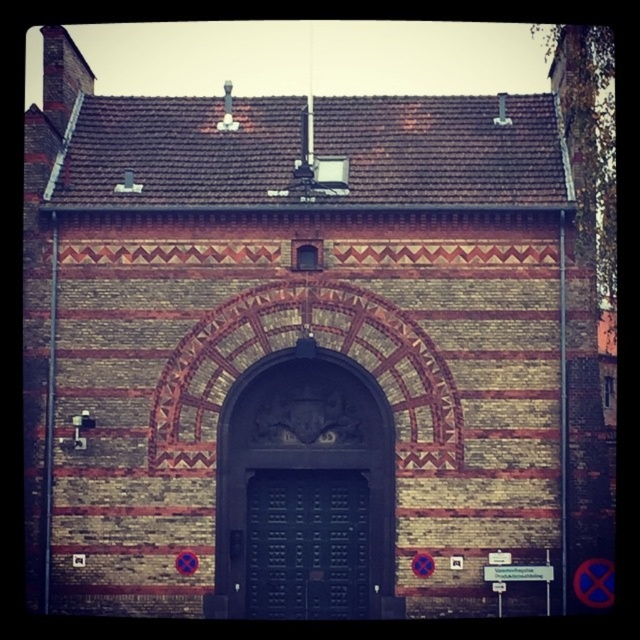
In the scene shown: Between dark green wooden door at center and dark wood door at center, which one is positioned higher?

Positioned higher is dark green wooden door at center.

Does dark green wooden door at center have a lesser height compared to dark wood door at center?

In fact, dark green wooden door at center may be taller than dark wood door at center.

Describe the element at coordinates (305, 490) in the screenshot. I see `dark green wooden door at center` at that location.

Where is `dark green wooden door at center`? This screenshot has width=640, height=640. dark green wooden door at center is located at coordinates (305, 490).